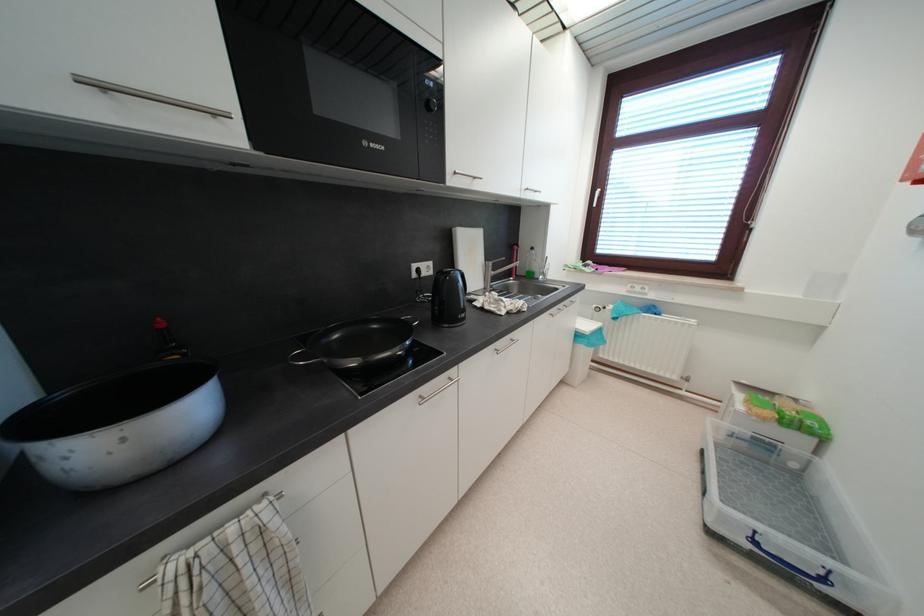
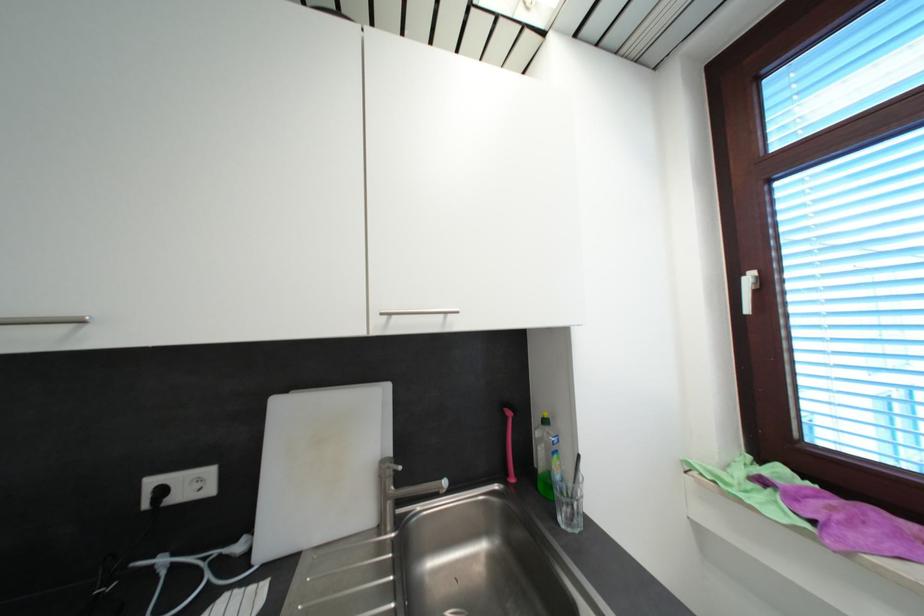
The point at (602, 195) is marked in the first image. Where is the corresponding point in the second image?

(754, 281)